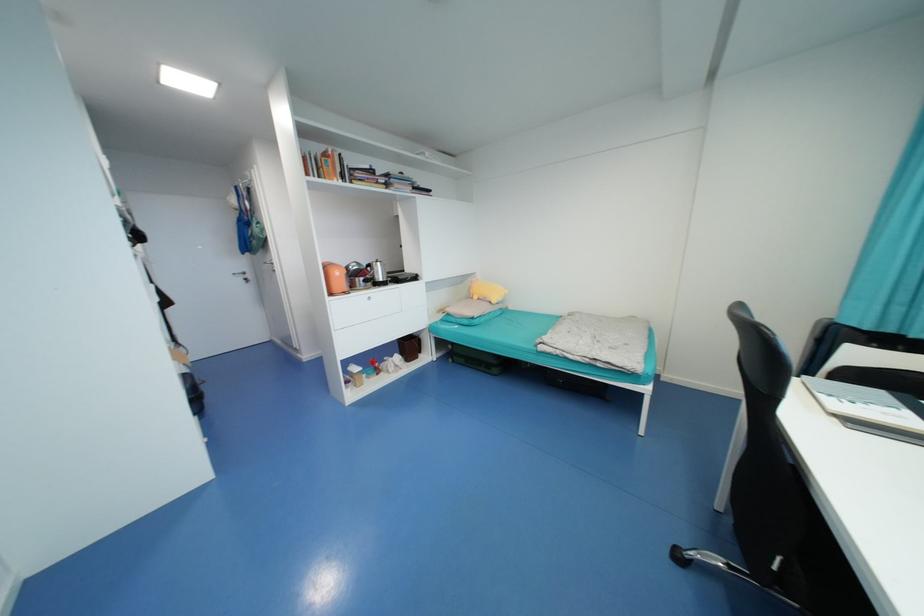
What do you see at coordinates (268, 265) in the screenshot? The width and height of the screenshot is (924, 616). I see `a silver drawer knob` at bounding box center [268, 265].